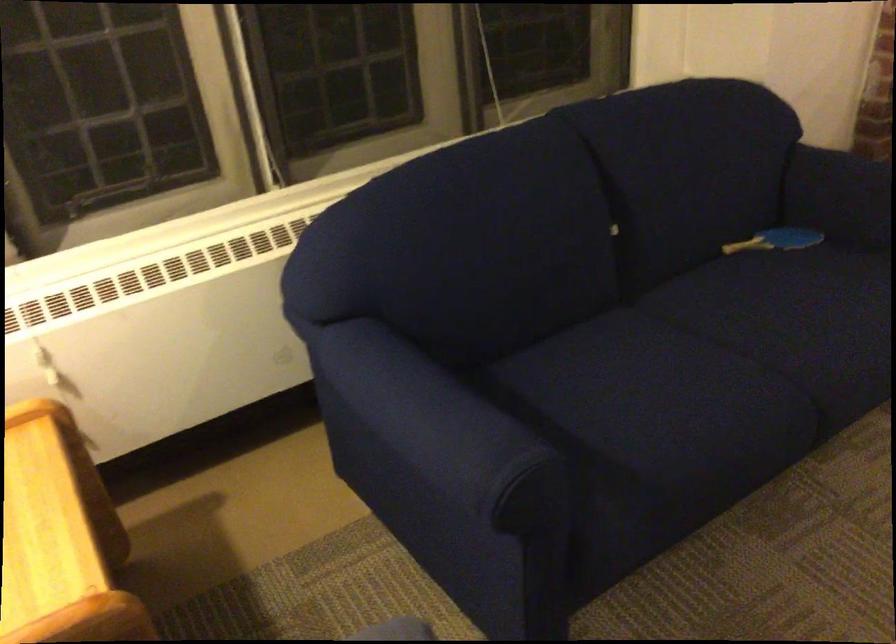
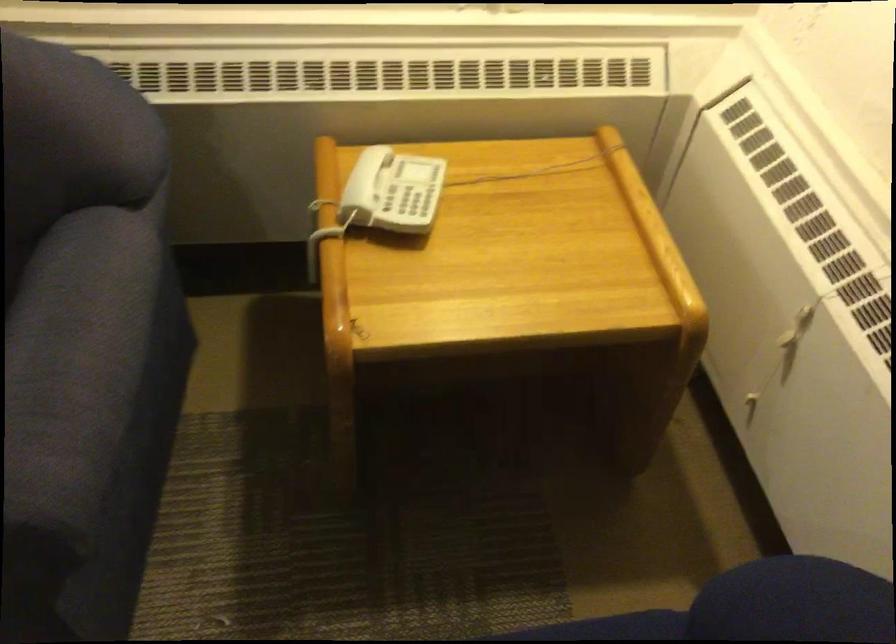
Find the pixel in the second image that matches point (358, 343) in the first image.

(612, 627)